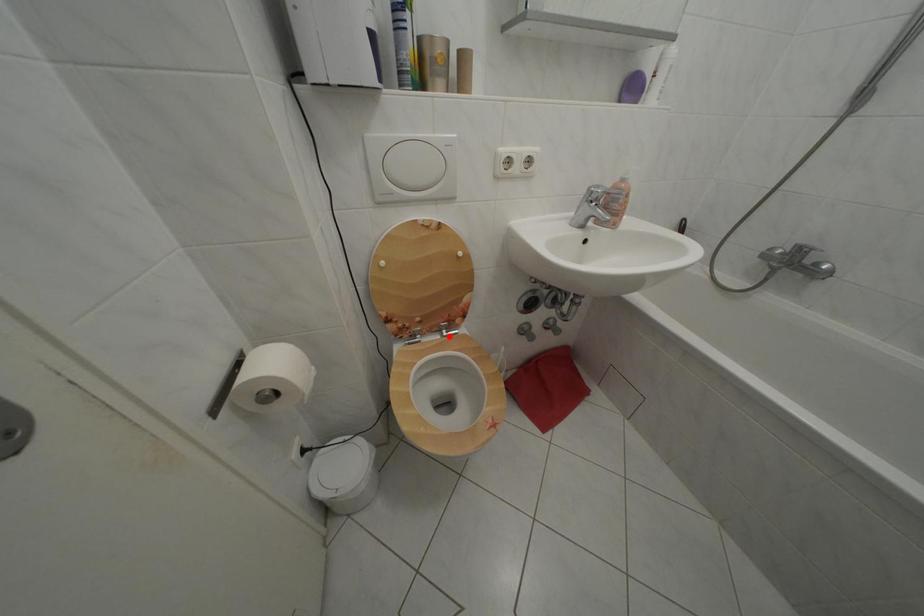
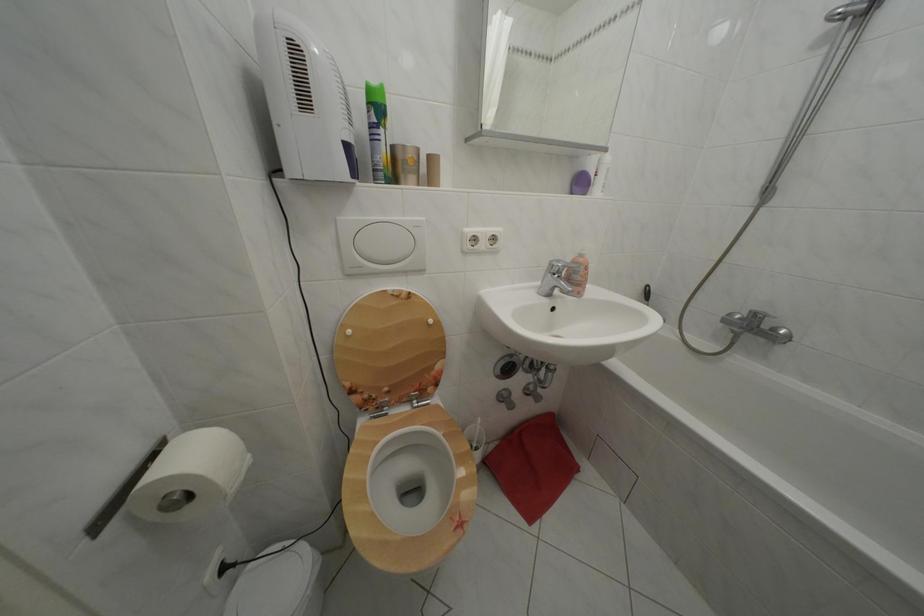
Question: A red point is marked in image1. In image2, is the corresponding 3D point closer to the camera or farther? Reply with the corresponding letter.

Choices:
 (A) The corresponding 3D point is closer.
 (B) The corresponding 3D point is farther.

Answer: (B)